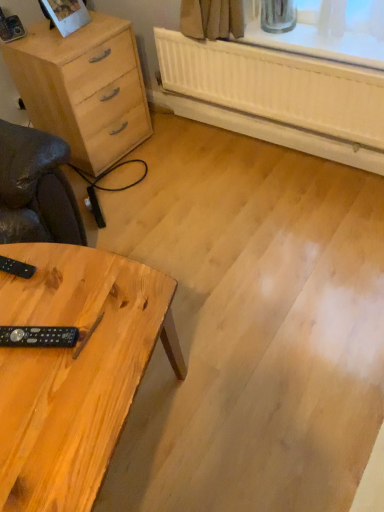
What are the coordinates of `free space in front of black plastic remote at lower left, acting as the 1th control starting from the bottom` in the screenshot? It's located at [x=40, y=407].